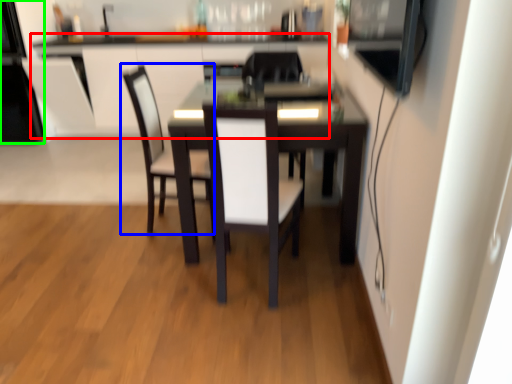
Question: Which object is positioned closest to computer desk (highlighted by a red box)? Select from chair (highlighted by a blue box) and appliance (highlighted by a green box).

Choices:
 (A) chair
 (B) appliance

Answer: (B)